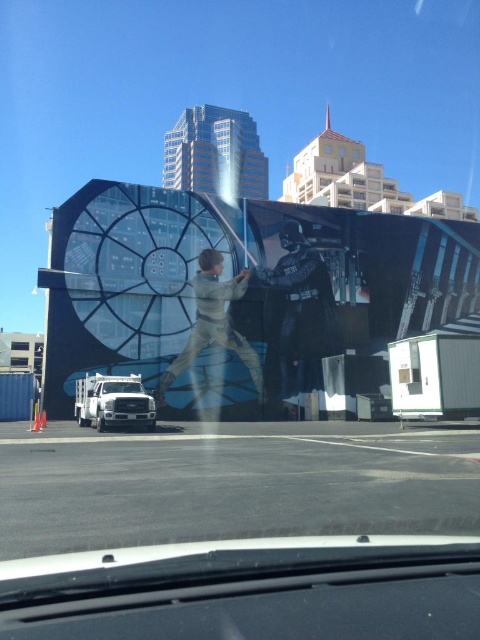
Based on the photo, you are a GPS device in a car. You need to guide the driver to look at the metallic silver armor at center. Where should the driver look relative to the dashboard?

The driver should look directly ahead of the dashboard since the metallic silver armor at center is positioned at point (298, 316), which is near the center of the view.

You are a photographer standing inside the car and want to capture both the metallic silver armor at center and the light brown fabric at center in the same shot. Which object should you focus on first to ensure both are in focus?

You should focus on the metallic silver armor at center first since it is closer to you than the light brown fabric at center, ensuring both will be in focus when focused on the closer object.

You are a passenger in the vehicle and notice the light brown fabric at center in the mural. Can you determine its exact position using the coordinate system provided?

The light brown fabric at center is located at coordinate point [214,323].